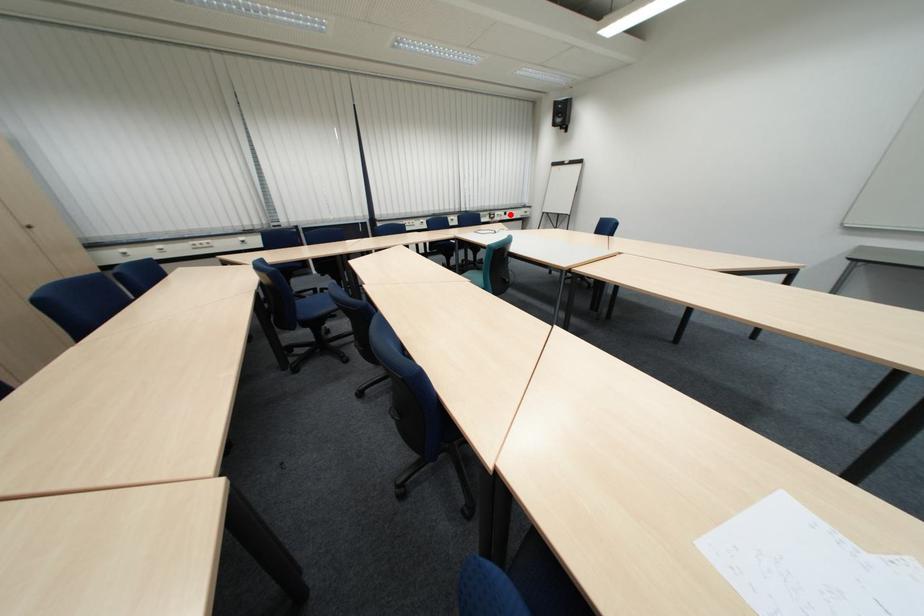
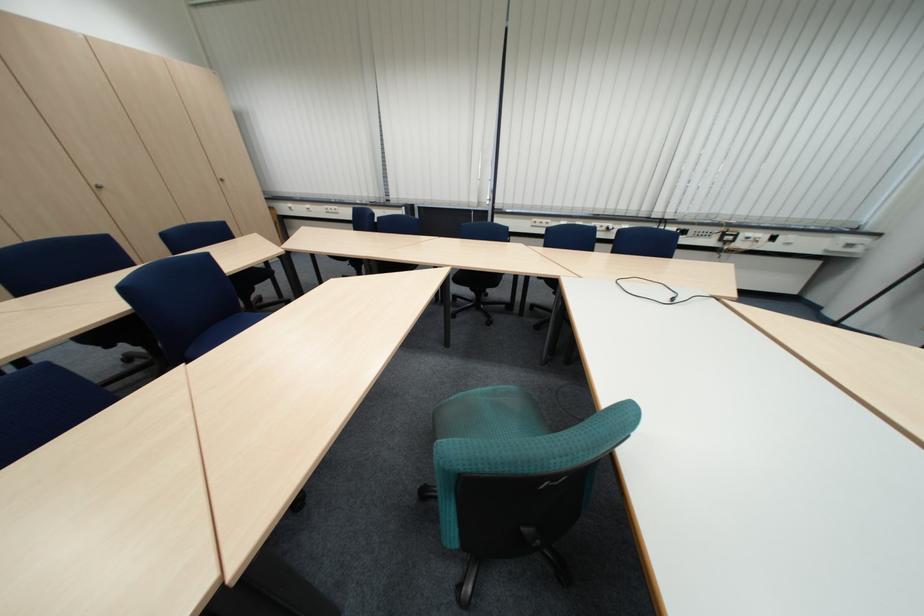
Question: I am providing you with two images of the same scene from different viewpoints. Image1 has a red point marked. In image2, the corresponding 3D location appears at what relative position? Reply with the corresponding letter.

Choices:
 (A) Closer
 (B) Farther

Answer: (B)